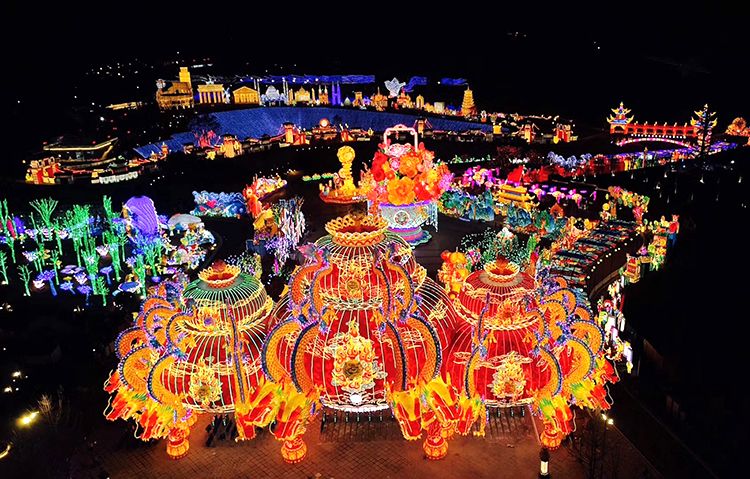
This screenshot has width=750, height=479. What are the coordinates of `orange lights` in the screenshot? It's located at (220, 310), (412, 340), (514, 371).